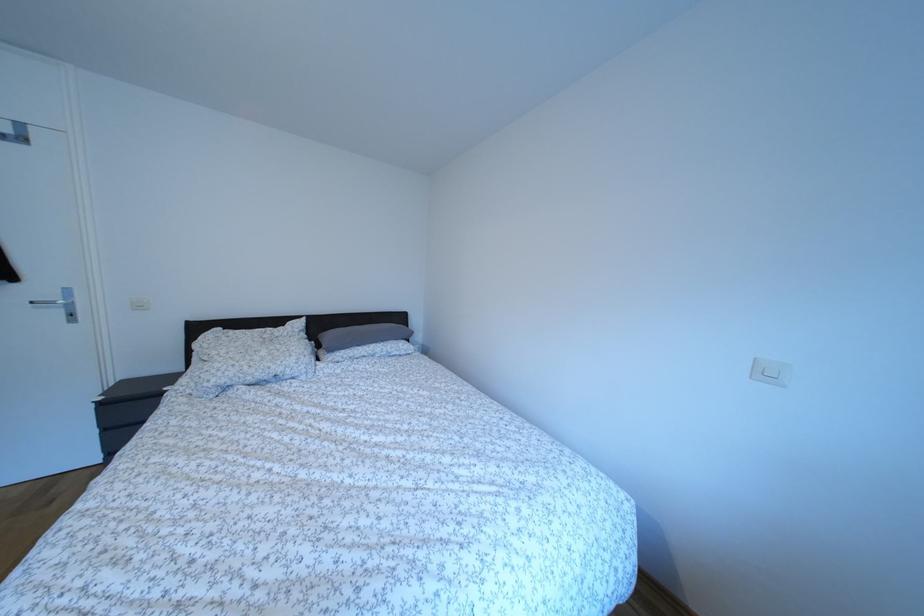
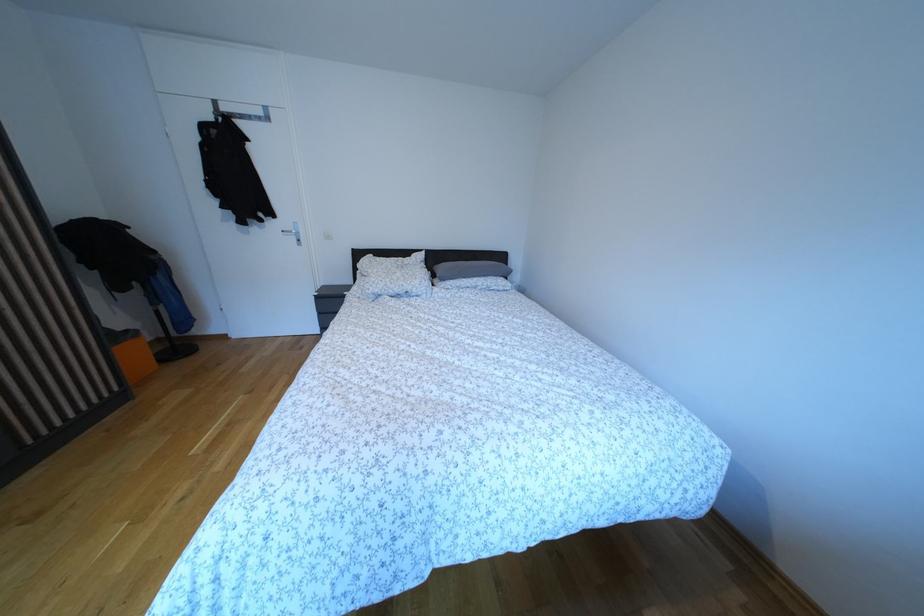
Question: How did the camera likely rotate?

Choices:
 (A) Left
 (B) Right
 (C) Up
 (D) Down

Answer: (A)